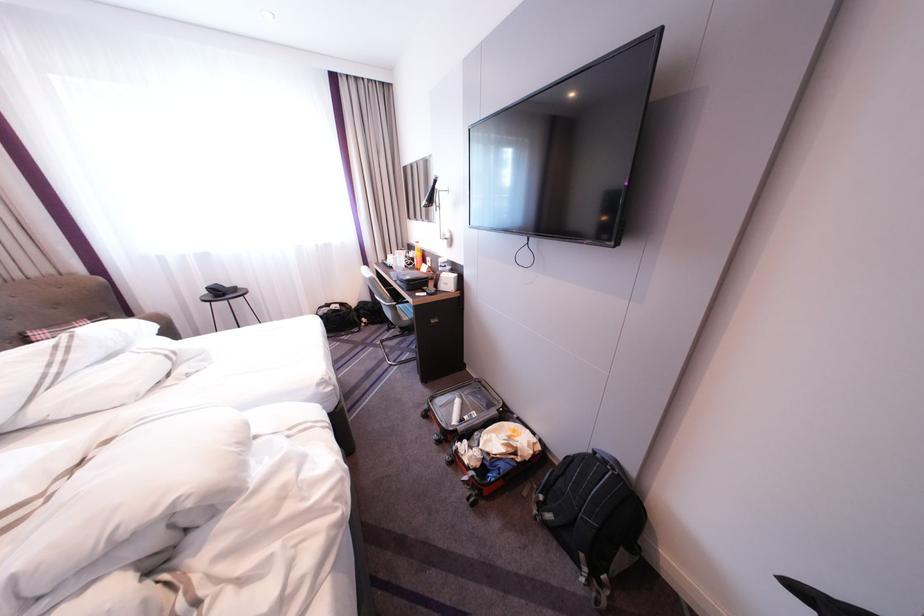
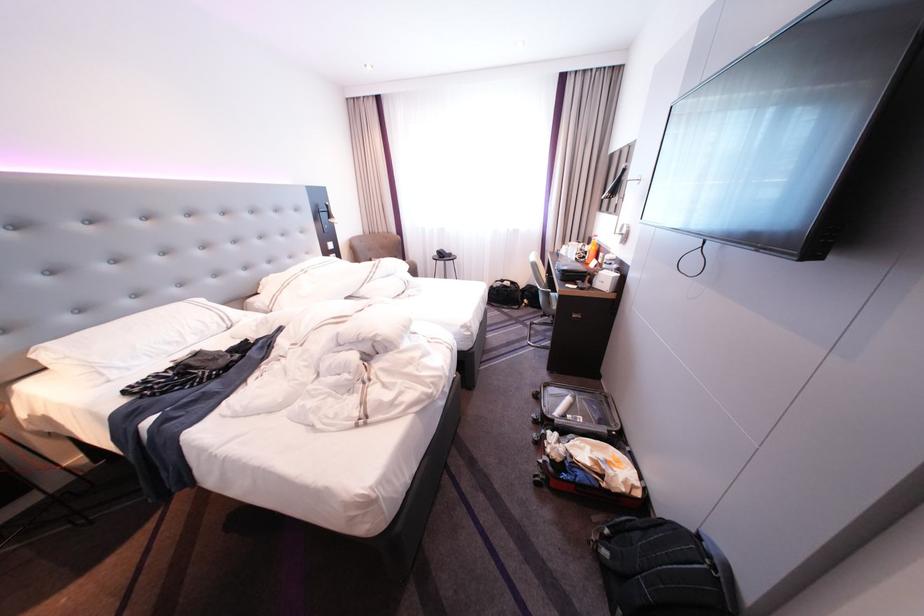
In the second image, find the point that corresponds to point (81, 349) in the first image.

(390, 267)